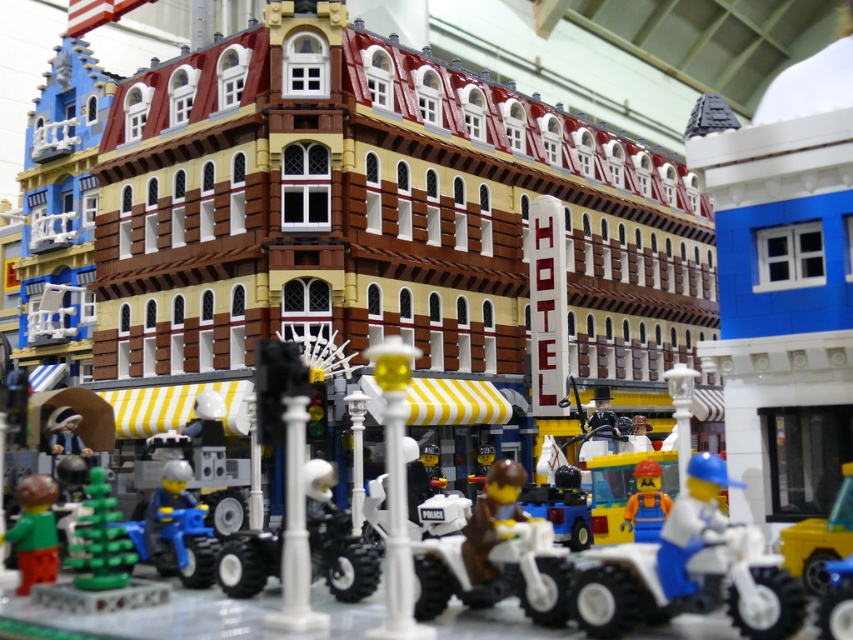
Question: Is white matte police motorcycle at center smaller than blue plastic motorcycle at lower left?

Choices:
 (A) yes
 (B) no

Answer: (B)

Question: Among these objects, which one is nearest to the camera?

Choices:
 (A) green matte figure at lower left
 (B) white matte police motorcycle at center
 (C) blue plastic figure at center
 (D) white matte quad bike at center

Answer: (D)

Question: Where is green matte christmas tree at lower left located in relation to blue plastic figure at center in the image?

Choices:
 (A) left
 (B) right

Answer: (A)

Question: Which point appears farthest from the camera in this image?

Choices:
 (A) (634, 499)
 (B) (26, 522)
 (C) (422, 548)
 (D) (94, 483)

Answer: (A)

Question: Which of these objects is positioned closest to the blue plastic figure at center?

Choices:
 (A) green matte figure at lower left
 (B) white matte quad bike at center
 (C) white matte police motorcycle at center

Answer: (B)

Question: Observing the image, what is the correct spatial positioning of blue plastic motorcycle at lower left in reference to green matte figure at lower left?

Choices:
 (A) above
 (B) below

Answer: (B)